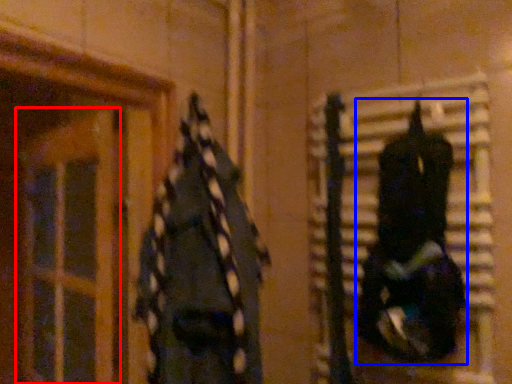
Question: Which object appears closest to the camera in this image, glass door (highlighted by a red box) or clothing (highlighted by a blue box)?

Choices:
 (A) glass door
 (B) clothing

Answer: (B)